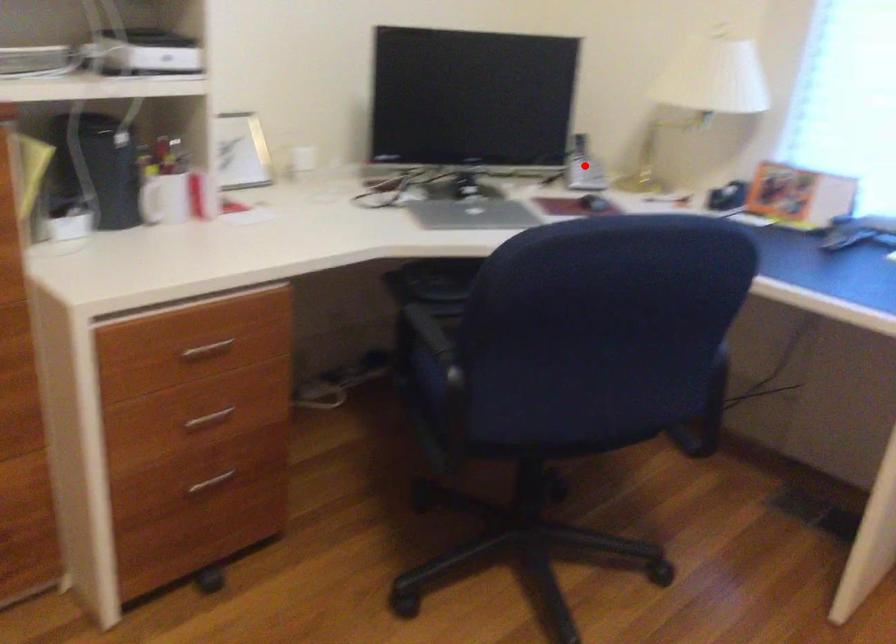
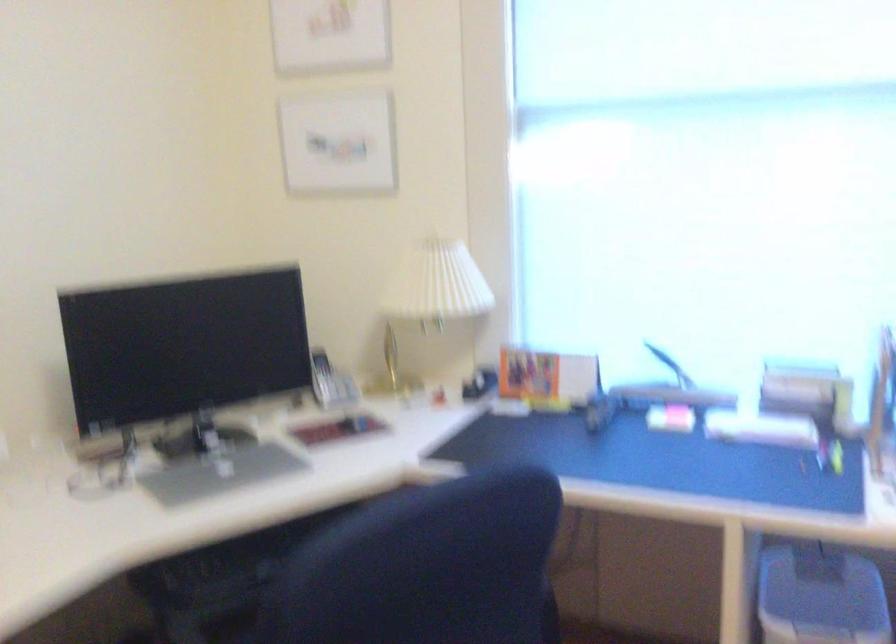
Where in the second image is the point corresponding to the highlighted location from the first image?

(330, 382)